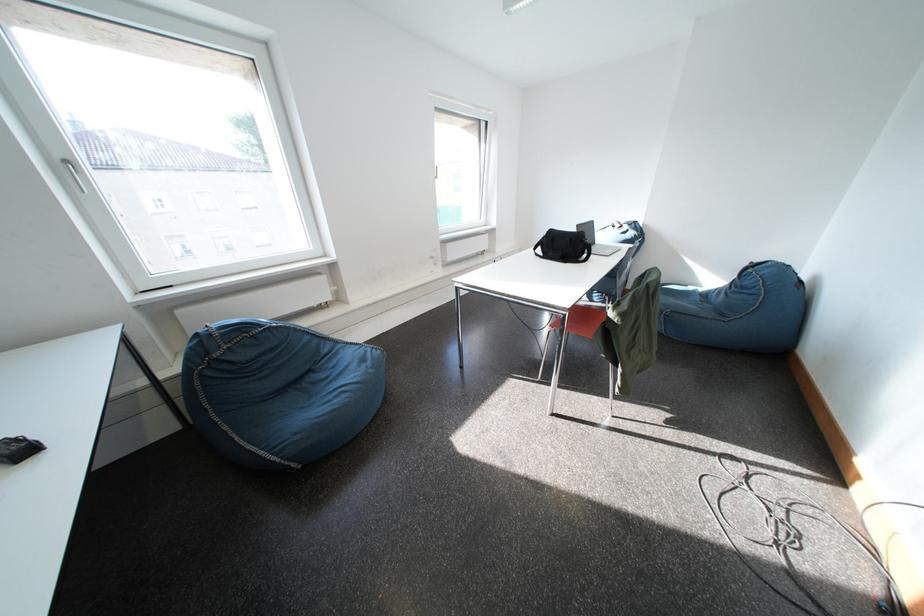
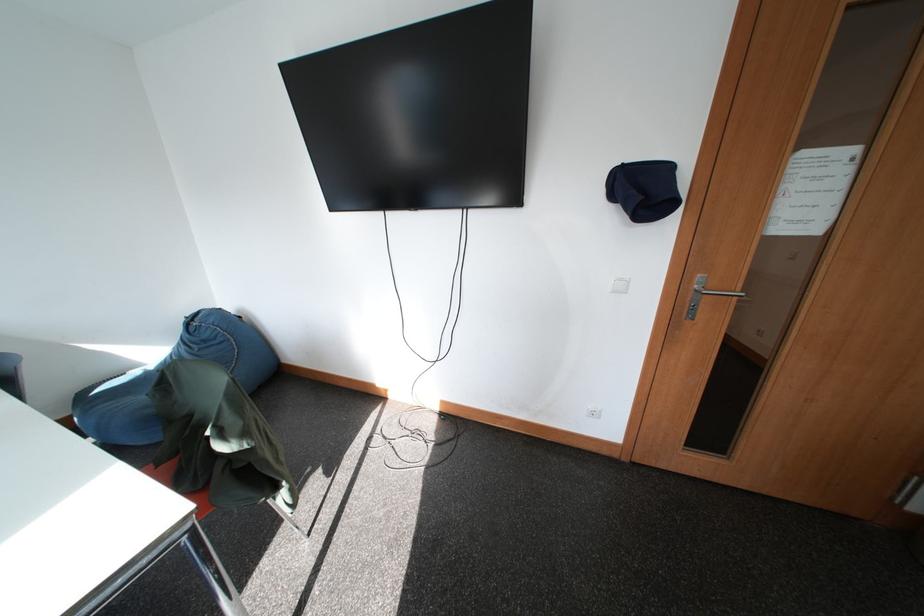
Looking at this image, the images are taken continuously from a first-person perspective. In which direction is your viewpoint rotating?

The camera's rotation is toward right-down.